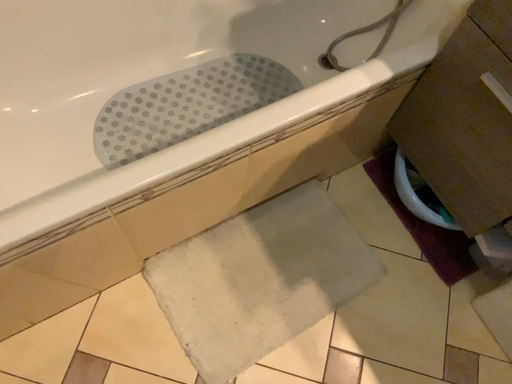
Identify the location of free space below white soft bath mat at lower center, positioned as the 2th bath mat in right-to-left order (from a real-world perspective). This screenshot has height=384, width=512. (267, 279).